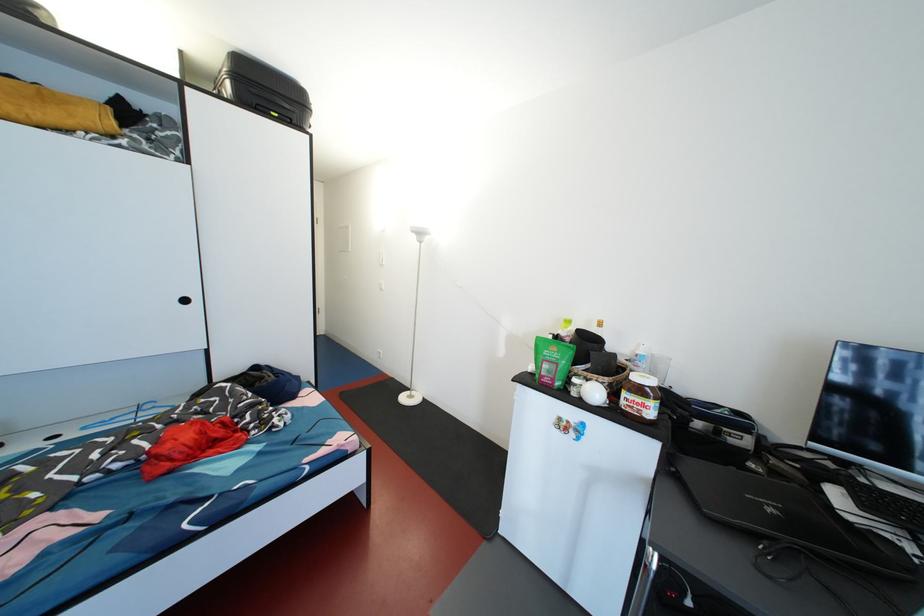
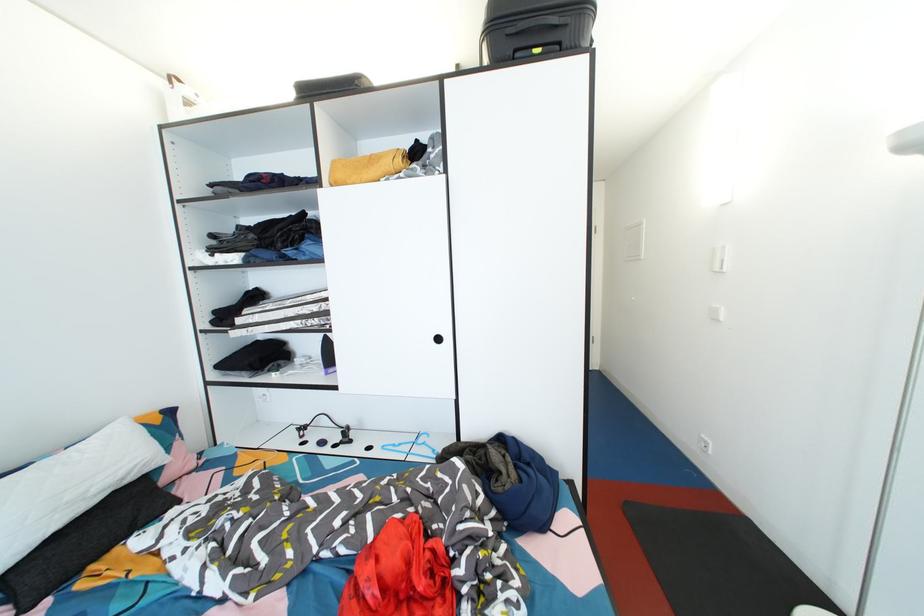
Where in the second image is the point corresponding to point (191, 306) from the first image?

(444, 344)